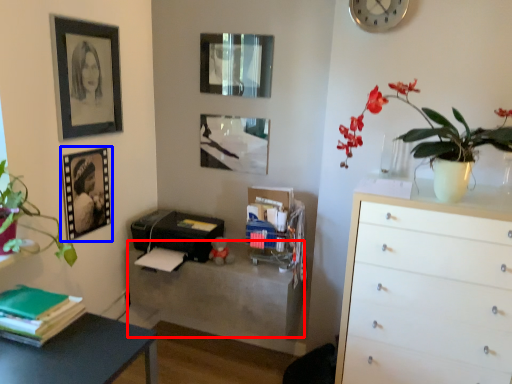
Question: Which object appears closest to the camera in this image, table (highlighted by a red box) or picture frame (highlighted by a blue box)?

Choices:
 (A) table
 (B) picture frame

Answer: (B)